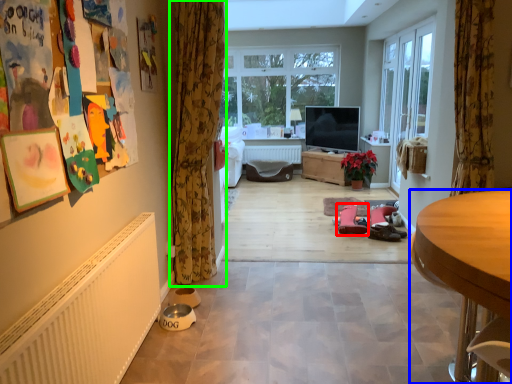
Question: Which is farther away from footwear (highlighted by a red box)? desk (highlighted by a blue box) or curtain (highlighted by a green box)?

Choices:
 (A) desk
 (B) curtain

Answer: (A)